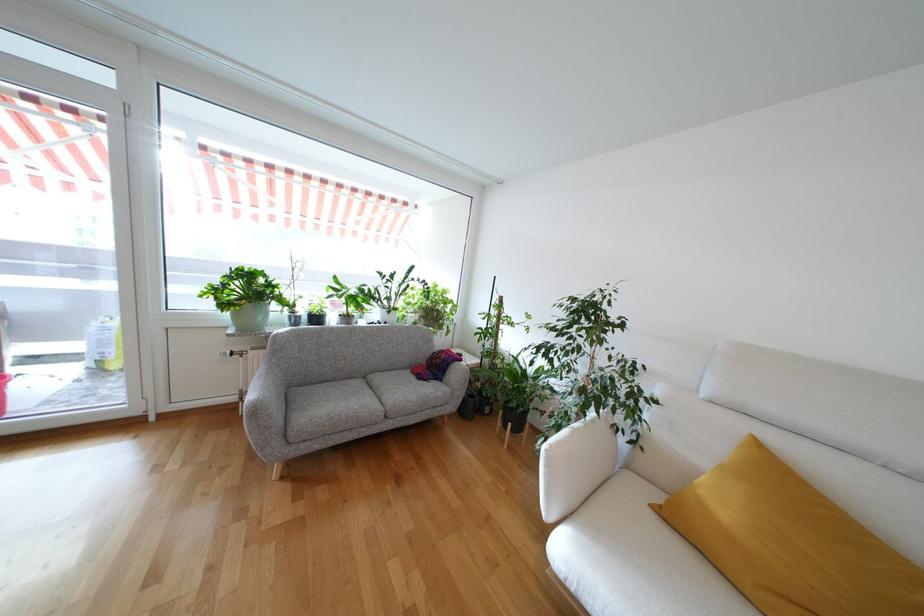
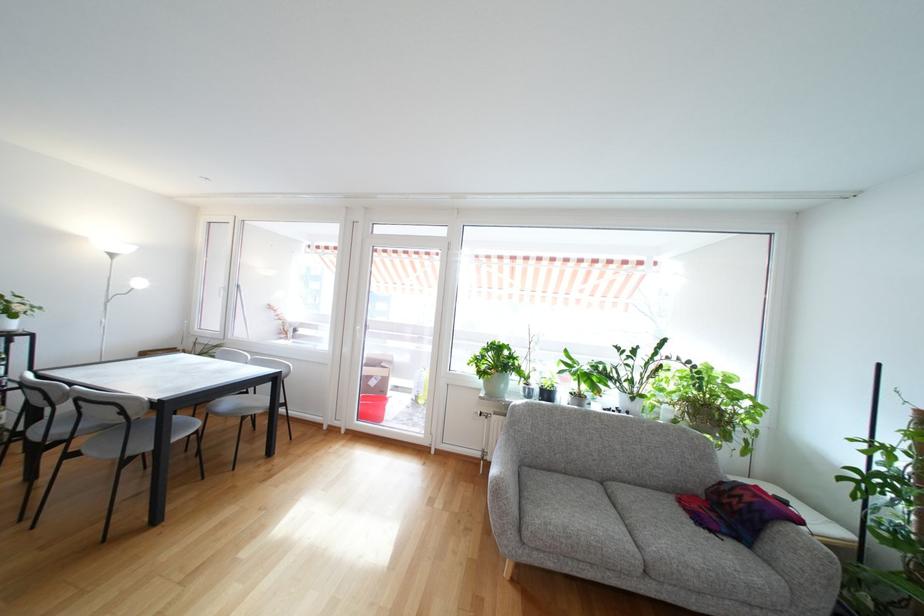
Question: The camera is either moving clockwise (left) or counter-clockwise (right) around the object. The first image is from the beginning of the video and the second image is from the end. Is the camera moving left or right when shooting the video?

Choices:
 (A) Left
 (B) Right

Answer: (B)